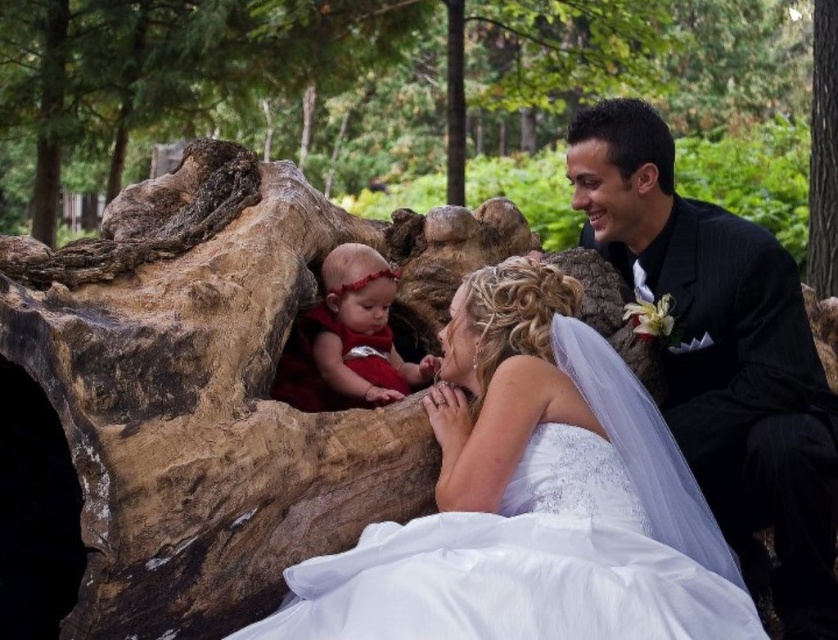
Is brown rough log at center bigger than white satin dress at center?

Indeed, brown rough log at center has a larger size compared to white satin dress at center.

Between point (529, 129) and point (696, 237), which one is positioned behind?

The point (529, 129) is more distant.

Between point (182, 104) and point (637, 154), which one is positioned behind?

Positioned behind is point (182, 104).

What are the coordinates of `brown rough log at center` in the screenshot? It's located at tap(208, 81).

This screenshot has height=640, width=838. What do you see at coordinates (722, 353) in the screenshot?
I see `white satin dress at center` at bounding box center [722, 353].

In the scene shown: Who is positioned more to the left, white satin dress at center or matte red dress at center?

From the viewer's perspective, matte red dress at center appears more on the left side.

This screenshot has height=640, width=838. What are the coordinates of `white satin dress at center` in the screenshot? It's located at (722, 353).

Between black pinstripe suit at right and matte red dress at center, which one is positioned lower?

matte red dress at center

Does black pinstripe suit at right appear under matte red dress at center?

Actually, black pinstripe suit at right is above matte red dress at center.

Is point (742, 237) closer to viewer compared to point (392, 292)?

No, it is behind (392, 292).

Locate an element on the screen. The width and height of the screenshot is (838, 640). black pinstripe suit at right is located at coordinates (722, 355).